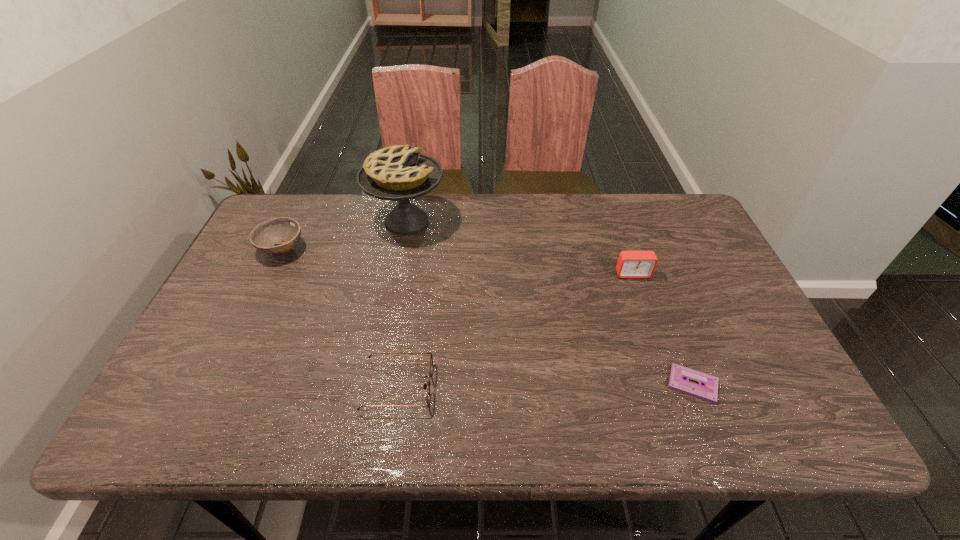
Find the location of a particular element. Image resolution: width=960 pixels, height=540 pixels. blank area at the left edge is located at coordinates (196, 345).

The image size is (960, 540). In order to click on free region at the right edge of the desktop in this screenshot , I will do `click(698, 272)`.

At what (x,y) coordinates should I click in order to perform the action: click on free space at the near left corner of the desktop. Please return your answer as a coordinate pair (x, y). The width and height of the screenshot is (960, 540). Looking at the image, I should click on (204, 409).

Where is `free spot at the far right corner of the desktop`? The image size is (960, 540). free spot at the far right corner of the desktop is located at coordinates (671, 230).

I want to click on vacant area between the tallest object and the videotape, so click(x=550, y=303).

The height and width of the screenshot is (540, 960). Identify the location of free spot between the bowl and the alarm clock. (458, 261).

Find the location of `vacant area that lies between the leftmost object and the sunglasses`. vacant area that lies between the leftmost object and the sunglasses is located at coordinates (340, 318).

What are the coordinates of `free space between the leftmost object and the tallest object` in the screenshot? It's located at (345, 235).

The width and height of the screenshot is (960, 540). I want to click on empty space between the second shortest object and the tallest object, so click(402, 303).

Where is `free space between the videotape and the tallest object`? The width and height of the screenshot is (960, 540). free space between the videotape and the tallest object is located at coordinates (550, 303).